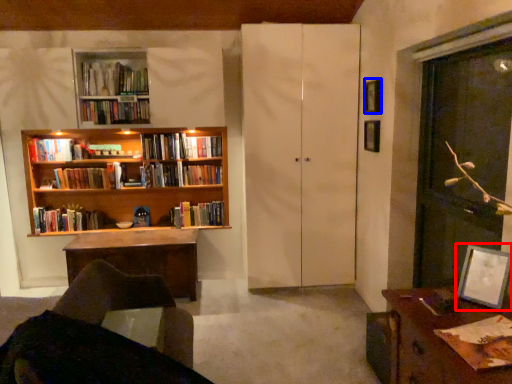
Question: Which of the following is the farthest to the observer, picture frame (highlighted by a red box) or picture frame (highlighted by a blue box)?

Choices:
 (A) picture frame
 (B) picture frame

Answer: (B)